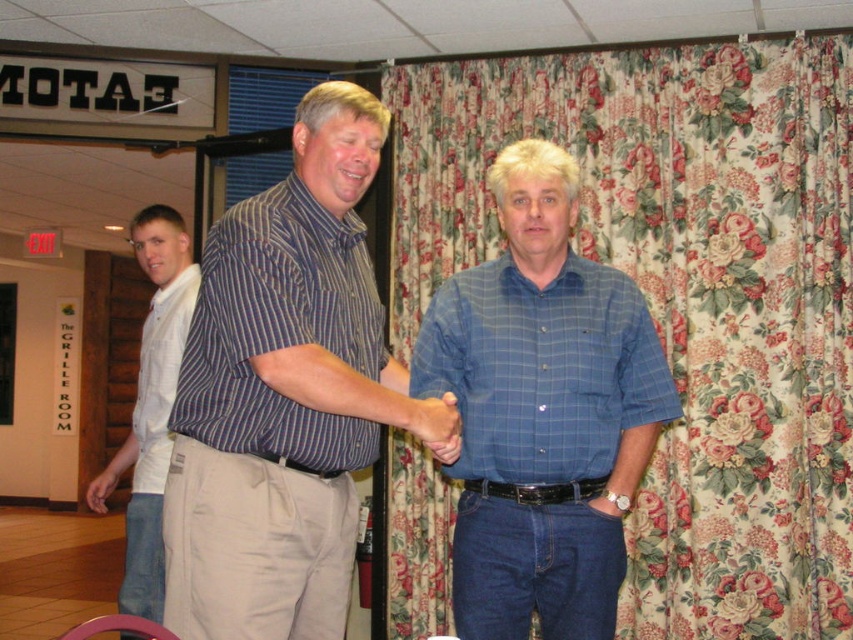
The width and height of the screenshot is (853, 640). What do you see at coordinates (683, 294) in the screenshot? I see `floral fabric curtain at right` at bounding box center [683, 294].

The height and width of the screenshot is (640, 853). What are the coordinates of `floral fabric curtain at right` in the screenshot? It's located at (683, 294).

Find the location of `floral fabric curtain at right`. floral fabric curtain at right is located at coordinates (683, 294).

Which is in front, point (221, 611) or point (466, 486)?

Point (221, 611) is more forward.

Who is more distant from viewer, (178, 528) or (495, 483)?

Positioned behind is point (495, 483).

At what (x,y) coordinates should I click in order to perform the action: click on striped cotton shirt at center. Please return your answer as a coordinate pair (x, y). Looking at the image, I should click on tap(286, 394).

Measure the distance from floral fabric curtain at right to striped cotton shirt at center.

They are 1.94 meters apart.

In the scene shown: Who is taller, floral fabric curtain at right or striped cotton shirt at center?

Standing taller between the two is floral fabric curtain at right.

Does point (810, 38) lie behind point (379, 364)?

Yes.

Where is `floral fabric curtain at right`? floral fabric curtain at right is located at coordinates (683, 294).